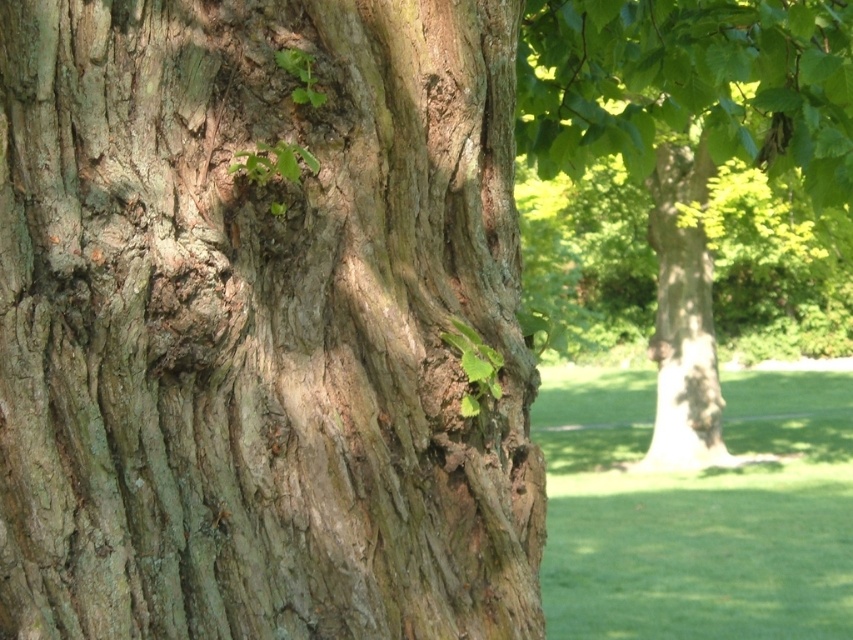
You are standing in a park and want to take a photo of the tree trunk. The camera you are using has a focus range of 2 meters. Can you capture the point at coordinates point [456,124] in focus without moving closer?

The point [456,124] is 2.49 meters from the camera, which is beyond the focus range of 2 meters. Therefore, you cannot capture it in focus without moving closer.

You are a gardener who wants to plant a new tree in the park. You see the green grass at lower right and the green leafy tree at center. Which area would you choose to plant the new tree if you want it to grow taller than the grass?

The green leafy tree at center is taller than the green grass at lower right, so planting the new tree where the green leafy tree at center is located would give it more space to grow taller than the grass.